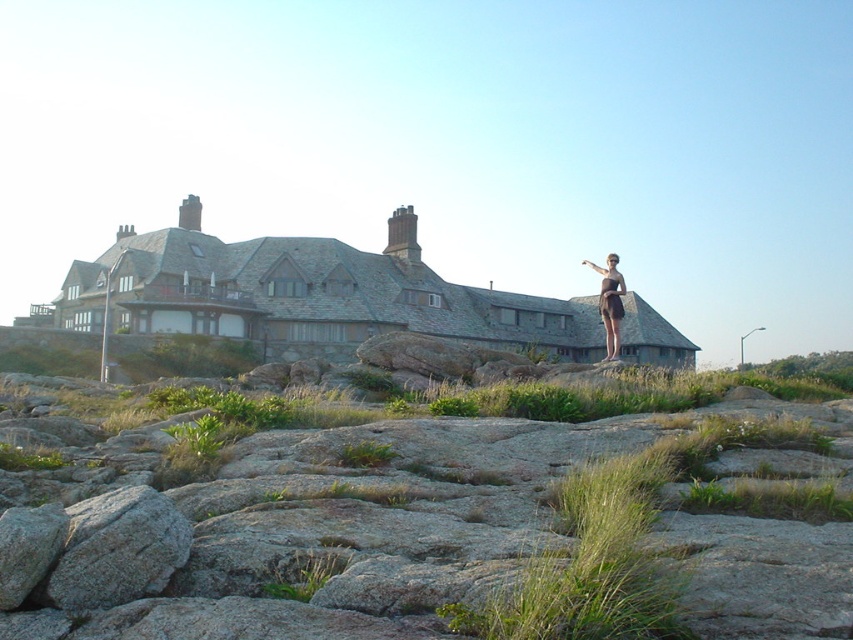
You are standing in front of the house and notice both the gray rock at upper center and the brown matte dress at upper right. Which object is nearer to you?

The gray rock at upper center is closer to the viewer than the brown matte dress at upper right.

You are standing in front of the house and notice the gray rock at upper center and the brown matte dress at upper right. Which object is taller?

The brown matte dress at upper right is taller than the gray rock at upper center.

You are a photographer setting up equipment in front of the house. You have a gray rock at upper center and a brown matte dress at upper right in your viewfinder. Which object is wider?

The brown matte dress at upper right is wider than the gray rock at upper center.